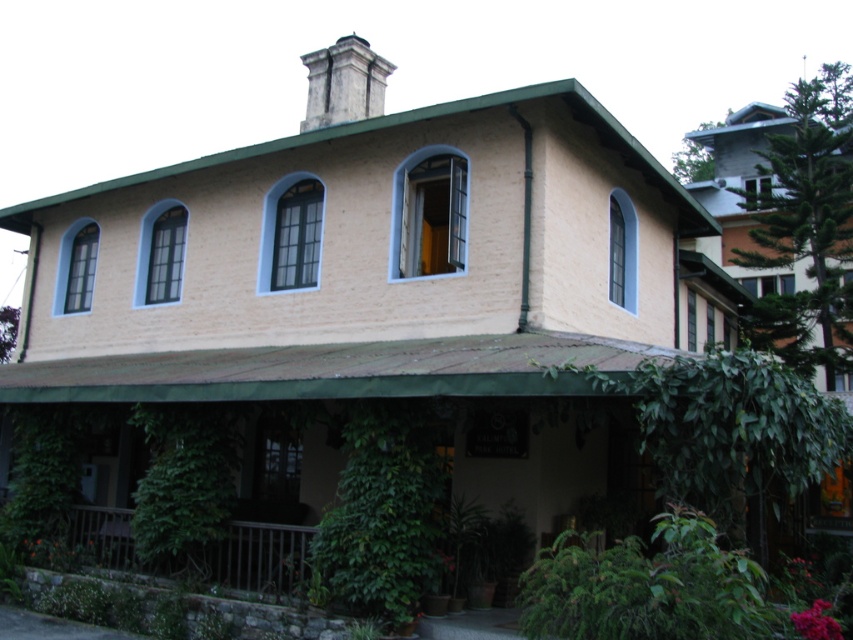
Question: In this image, where is green leafy plant at lower center located relative to brown wooden porch at lower left?

Choices:
 (A) left
 (B) right

Answer: (B)

Question: Among these objects, which one is nearest to the camera?

Choices:
 (A) brown wooden porch at lower left
 (B) green leafy plant at lower center

Answer: (B)

Question: Which point is farther from the camera taking this photo?

Choices:
 (A) (308, 534)
 (B) (349, 593)

Answer: (A)

Question: Which of the following is the closest to the observer?

Choices:
 (A) green leafy plant at lower center
 (B) brown wooden porch at lower left

Answer: (A)

Question: Is green leafy plant at lower center bigger than brown wooden porch at lower left?

Choices:
 (A) yes
 (B) no

Answer: (A)

Question: Considering the relative positions of green leafy plant at lower center and brown wooden porch at lower left in the image provided, where is green leafy plant at lower center located with respect to brown wooden porch at lower left?

Choices:
 (A) right
 (B) left

Answer: (A)